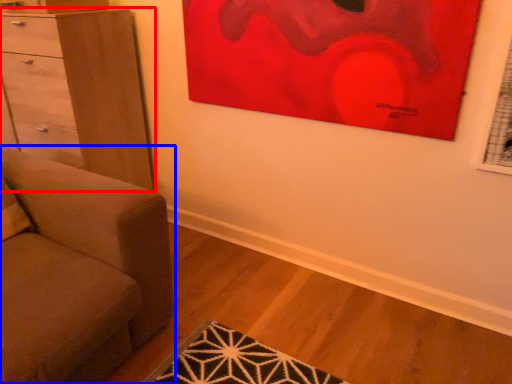
Question: Which point is further to the camera, chest of drawers (highlighted by a red box) or studio couch (highlighted by a blue box)?

Choices:
 (A) chest of drawers
 (B) studio couch

Answer: (A)